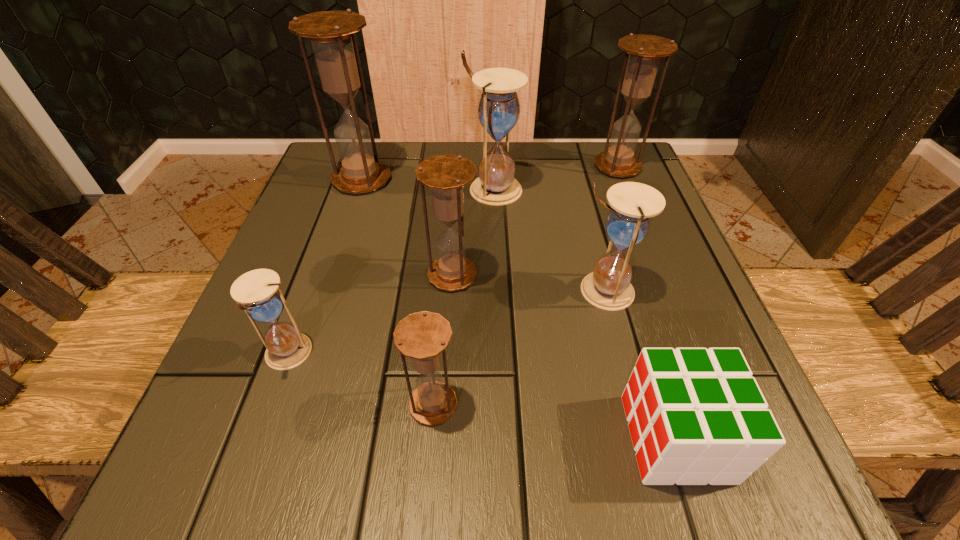
In order to click on the leftmost brown hourglass in this screenshot , I will do `click(332, 33)`.

Find the location of a particular element. The height and width of the screenshot is (540, 960). the tallest object is located at coordinates (332, 33).

Identify the location of the rightmost brown hourglass. The width and height of the screenshot is (960, 540). (645, 51).

The image size is (960, 540). In order to click on the biggest white hourglass in this screenshot , I will do `click(498, 111)`.

Image resolution: width=960 pixels, height=540 pixels. I want to click on the farthest white hourglass, so click(498, 111).

You are a GUI agent. You are given a task and a screenshot of the screen. Output one action in this format:
    pyautogui.click(x=<x>, y=<y>)
    Task: Click on the second smallest brown hourglass
    
    Given the screenshot: What is the action you would take?
    pyautogui.click(x=446, y=175)

Locate an element on the screen. The height and width of the screenshot is (540, 960). the second farthest white hourglass is located at coordinates (608, 287).

This screenshot has width=960, height=540. What are the coordinates of `the second biggest white hourglass` in the screenshot? It's located at (608, 287).

Identify the location of the sixth farthest hourglass. The width and height of the screenshot is (960, 540). (257, 292).

Identify the location of the smallest white hourglass. (257, 292).